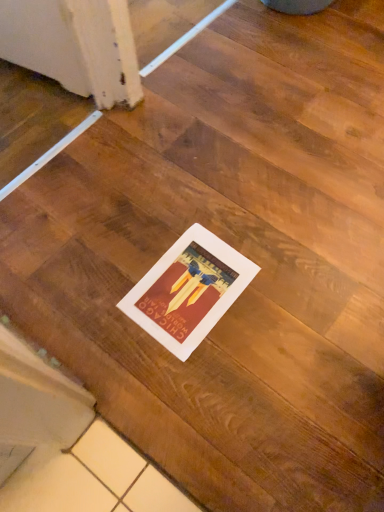
This screenshot has width=384, height=512. I want to click on vacant area that is situated to the right of matte paper poster at center, so click(284, 285).